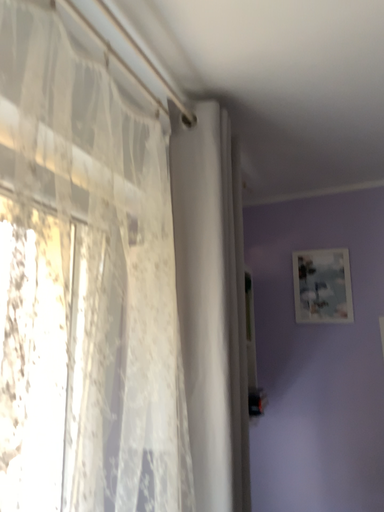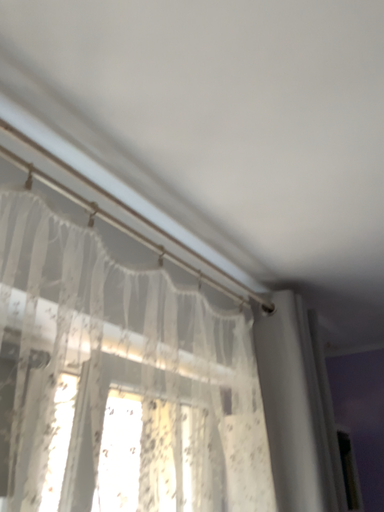
Question: Which way did the camera rotate in the video?

Choices:
 (A) rotated right
 (B) rotated left

Answer: (B)